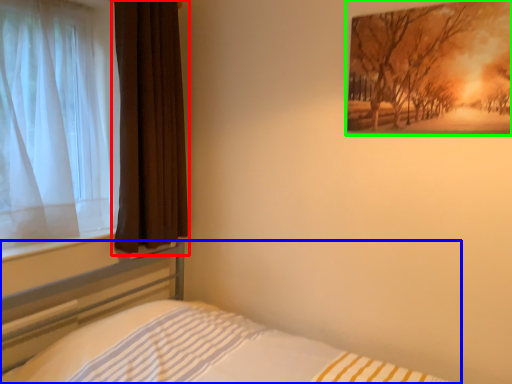
Question: Estimate the real-world distances between objects in this image. Which object is closer to curtain (highlighted by a red box), bed (highlighted by a blue box) or picture frame (highlighted by a green box)?

Choices:
 (A) bed
 (B) picture frame

Answer: (A)